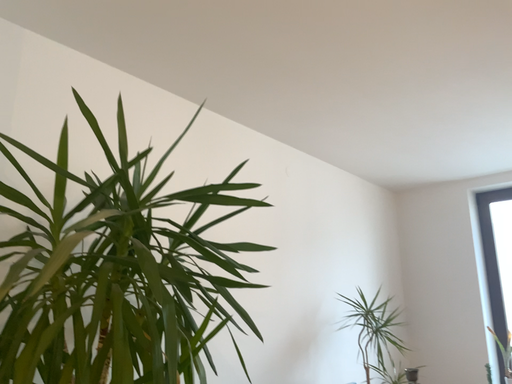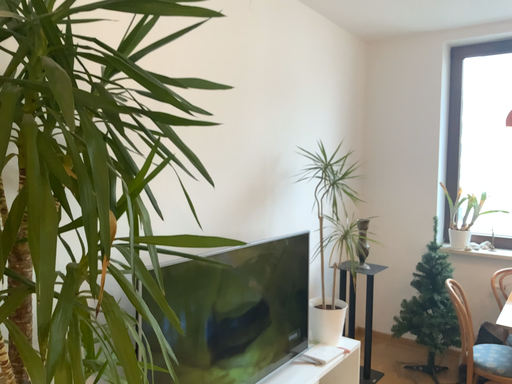
Question: How did the camera likely rotate when shooting the video?

Choices:
 (A) rotated upward
 (B) rotated downward

Answer: (B)